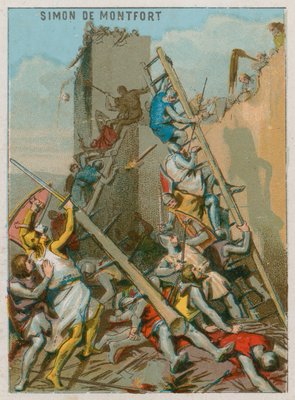
The height and width of the screenshot is (400, 295). I want to click on ladder, so click(x=231, y=204).